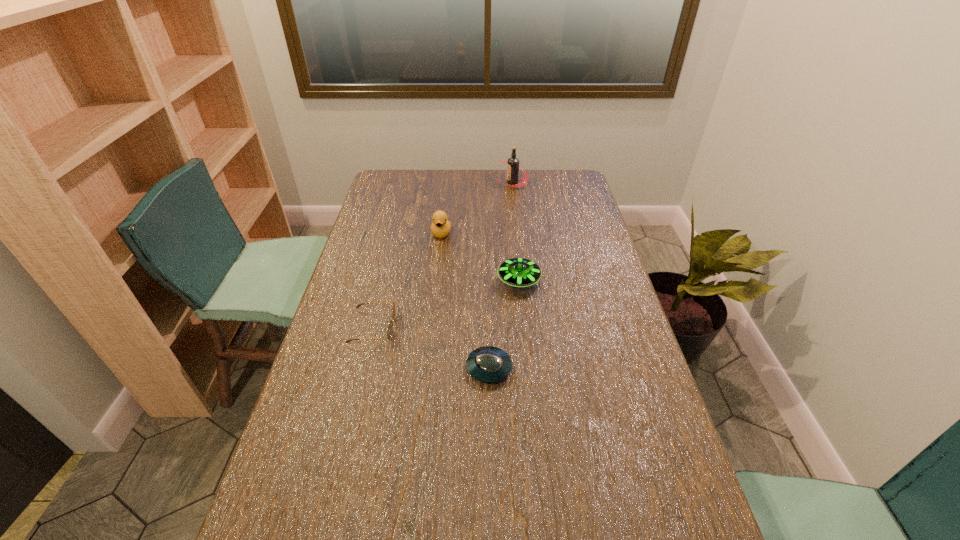
At what (x,y) coordinates should I click in order to perform the action: click on root beer. Please return your answer as a coordinate pair (x, y). The height and width of the screenshot is (540, 960). Looking at the image, I should click on (513, 164).

The width and height of the screenshot is (960, 540). I want to click on the farthest object, so tap(513, 164).

Find the location of a particular element. Image resolution: width=960 pixels, height=540 pixels. the fourth nearest object is located at coordinates click(x=440, y=227).

Locate an element on the screen. The width and height of the screenshot is (960, 540). duckling is located at coordinates (440, 227).

The height and width of the screenshot is (540, 960). I want to click on the taller saucer, so click(518, 272).

At what (x,y) coordinates should I click in order to perform the action: click on the farther saucer. Please return your answer as a coordinate pair (x, y). The image size is (960, 540). Looking at the image, I should click on (518, 272).

Image resolution: width=960 pixels, height=540 pixels. I want to click on the fourth farthest object, so click(390, 325).

You are a GUI agent. You are given a task and a screenshot of the screen. Output one action in this format:
    pyautogui.click(x=<x>, y=<y>)
    Task: Click on the sunglasses
    
    Given the screenshot: What is the action you would take?
    pyautogui.click(x=390, y=325)

At what (x,y) coordinates should I click in order to perform the action: click on the nearest object. Please return your answer as a coordinate pair (x, y). The height and width of the screenshot is (540, 960). Looking at the image, I should click on (488, 364).

Locate an element on the screen. the shorter saucer is located at coordinates (488, 364).